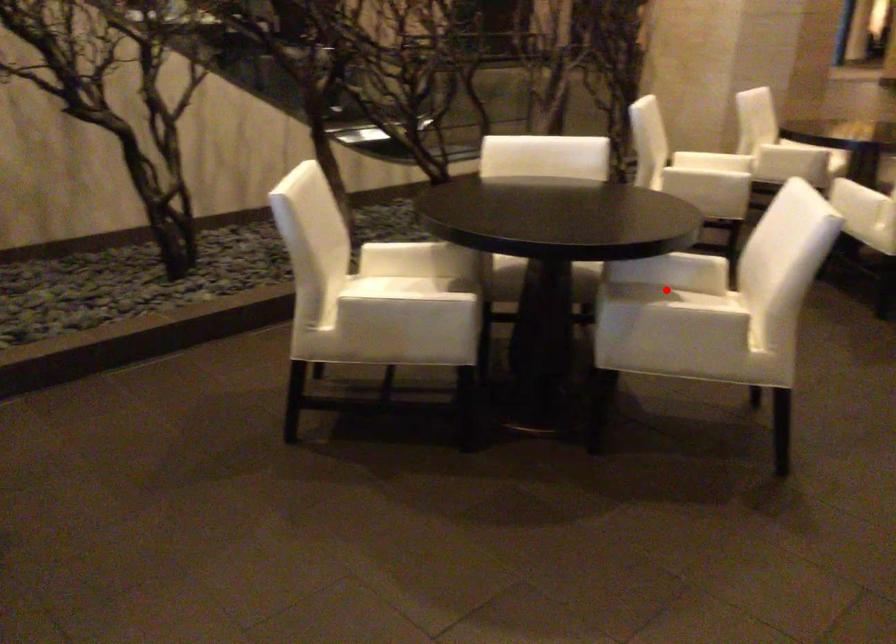
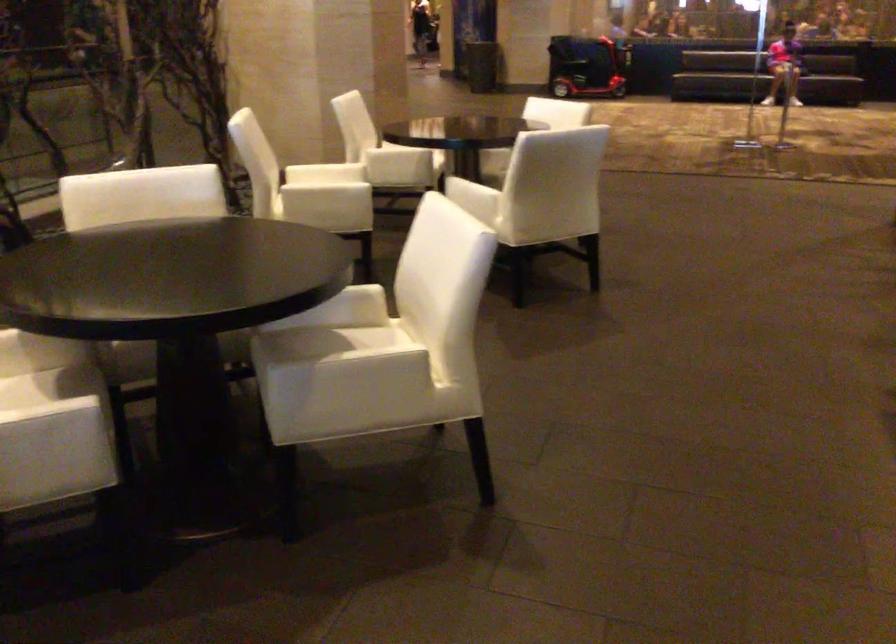
Find the pixel in the second image that matches the highlighted location in the first image.

(324, 339)